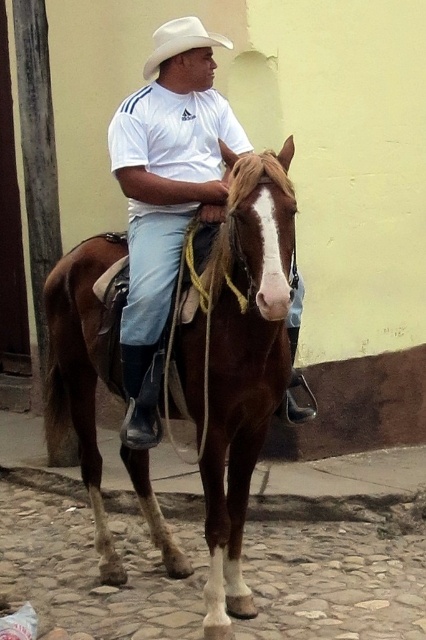
You are a photographer trying to capture the brown glossy horse at center and the white matte cowboy hat at upper center in a single frame. Considering their sizes, which object should you focus on first to ensure both are in focus?

The brown glossy horse at center is much taller than the white matte cowboy hat at upper center, so you should focus on the brown glossy horse at center first to ensure both are in focus.

You are a photographer standing 25 inches away from the brown glossy horse at center. You want to take a photo of the white matte shirt at center without the horse blocking it. Is it possible to do so?

The brown glossy horse at center is 20.15 inches away from the white matte shirt at center. Since you are standing 25 inches away from the horse, the shirt is within your reach. However, the horse is blocking the shirt, so you need to move around the horse to capture the shirt without obstruction.

You are standing in front of the brown glossy horse at center. If you take a step forward, will you be closer than 9.40 feet to the horse?

Yes, because stepping forward reduces the distance from the original 9.40 feet, so you would be closer than 9.40 feet to the brown glossy horse at center.